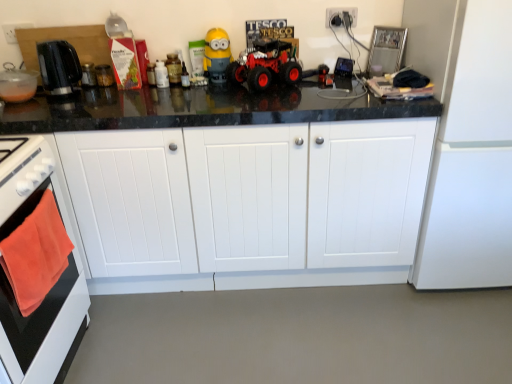
This screenshot has width=512, height=384. What do you see at coordinates (341, 14) in the screenshot? I see `white plastic electrical outlet at upper right` at bounding box center [341, 14].

Locate an element on the screen. white plastic electrical outlet at upper right is located at coordinates (341, 14).

The width and height of the screenshot is (512, 384). What do you see at coordinates (88, 75) in the screenshot? I see `metallic glass jar at upper left, arranged as the second appliance when viewed from the right` at bounding box center [88, 75].

I want to click on white matte refrigerator at right, so click(466, 141).

Describe the element at coordinates (250, 203) in the screenshot. I see `white wood cabinets at center` at that location.

Locate an element on the screen. matte black kettle at left, which appears as the third appliance when viewed from the right is located at coordinates (17, 84).

The image size is (512, 384). Identify the location of white plastic electrical outlet at upper right. (341, 14).

From the image's perspective, which one is positioned higher, transparent glass jar at center, which ranks as the 1th appliance in right-to-left order, or white matte refrigerator at right?

transparent glass jar at center, which ranks as the 1th appliance in right-to-left order, from the image's perspective.

Is transparent glass jar at center, acting as the third appliance starting from the left, in front of or behind white matte refrigerator at right in the image?

transparent glass jar at center, acting as the third appliance starting from the left, is positioned farther from the viewer than white matte refrigerator at right.

Which point is more distant from viewer, (109, 84) or (479, 238)?

The point (109, 84) is farther.

Is transparent glass jar at center, acting as the third appliance starting from the left, to the left or to the right of white matte refrigerator at right in the image?

In the image, transparent glass jar at center, acting as the third appliance starting from the left, appears on the left side of white matte refrigerator at right.

Which is more to the left, orange towel at left or black plastic kettle at left?

Positioned to the left is orange towel at left.

Looking at this image, how far apart are orange towel at left and black plastic kettle at left?

orange towel at left and black plastic kettle at left are 26.48 inches apart from each other.

Can you confirm if orange towel at left is smaller than black plastic kettle at left?

Incorrect, orange towel at left is not smaller in size than black plastic kettle at left.

Can black plastic kettle at left be found inside orange towel at left?

Actually, black plastic kettle at left is outside orange towel at left.

Is point (83, 67) less distant than point (65, 60)?

That is False.

From the image's perspective, is metallic glass jar at upper left, arranged as the second appliance when viewed from the right, on top of black plastic kettle at left?

Yes, from the image's perspective, metallic glass jar at upper left, arranged as the second appliance when viewed from the right, is on top of black plastic kettle at left.

Considering the sizes of metallic glass jar at upper left, positioned as the second appliance in left-to-right order, and black plastic kettle at left in the image, is metallic glass jar at upper left, positioned as the second appliance in left-to-right order, taller or shorter than black plastic kettle at left?

In the image, metallic glass jar at upper left, positioned as the second appliance in left-to-right order, appears to be shorter than black plastic kettle at left.

Is metallic glass jar at upper left, positioned as the second appliance in left-to-right order, located outside black plastic kettle at left?

Yes, metallic glass jar at upper left, positioned as the second appliance in left-to-right order, is located beyond the bounds of black plastic kettle at left.

Considering the positions of point (261, 74) and point (92, 67), is point (261, 74) closer or farther from the camera than point (92, 67)?

Point (261, 74) is positioned closer to the camera compared to point (92, 67).

From the image's perspective, relative to metallic glass jar at upper left, positioned as the second appliance in left-to-right order, is rubberized red toy car at center above or below?

From the image's perspective, rubberized red toy car at center appears above metallic glass jar at upper left, positioned as the second appliance in left-to-right order.

Who is smaller, rubberized red toy car at center or metallic glass jar at upper left, arranged as the second appliance when viewed from the right?

metallic glass jar at upper left, arranged as the second appliance when viewed from the right, is smaller.

From a real-world perspective, is rubberized red toy car at center physically located above or below metallic glass jar at upper left, arranged as the second appliance when viewed from the right?

From a real-world perspective, rubberized red toy car at center is physically above metallic glass jar at upper left, arranged as the second appliance when viewed from the right.

From the orange towel at left, count 2nd appliances backward and point to it. Please provide its 2D coordinates.

[(104, 75)]

Can you confirm if transparent glass jar at center, which ranks as the 1th appliance in right-to-left order, is smaller than orange towel at left?

Yes.

In terms of height, does transparent glass jar at center, acting as the third appliance starting from the left, look taller or shorter compared to orange towel at left?

In the image, transparent glass jar at center, acting as the third appliance starting from the left, appears to be shorter than orange towel at left.

Between point (110, 71) and point (30, 137), which one is positioned behind?

The point (110, 71) is more distant.

Does white plastic electrical outlet at upper right touch white matte refrigerator at right?

white plastic electrical outlet at upper right and white matte refrigerator at right are not in contact.

Does white plastic electrical outlet at upper right have a greater height compared to white matte refrigerator at right?

No, white plastic electrical outlet at upper right is not taller than white matte refrigerator at right.

In the scene shown: From a real-world perspective, which object stands above the other?

white plastic electrical outlet at upper right is physically above.

Can you confirm if white plastic electrical outlet at upper right is wider than white matte refrigerator at right?

No.

From a real-world perspective, is matte black kettle at left, the first appliance from the left, positioned above or below transparent glass jar at center, acting as the third appliance starting from the left?

In terms of real-world spatial position, matte black kettle at left, the first appliance from the left, is above transparent glass jar at center, acting as the third appliance starting from the left.

How different are the orientations of matte black kettle at left, the first appliance from the left, and transparent glass jar at center, acting as the third appliance starting from the left, in degrees?

0.00454 degrees separate the facing orientations of matte black kettle at left, the first appliance from the left, and transparent glass jar at center, acting as the third appliance starting from the left.

From their relative heights in the image, would you say matte black kettle at left, the first appliance from the left, is taller or shorter than transparent glass jar at center, which ranks as the 1th appliance in right-to-left order?

In the image, matte black kettle at left, the first appliance from the left, appears to be taller than transparent glass jar at center, which ranks as the 1th appliance in right-to-left order.

I want to click on refrigerator directly beneath the transparent glass jar at center, acting as the third appliance starting from the left (from a real-world perspective), so click(466, 141).

This screenshot has height=384, width=512. I want to click on kitchen appliance to the right of orange towel at left, so click(x=58, y=67).

Estimate the real-world distances between objects in this image. Which object is further from white wood cabinets at center, rubberized red toy car at center or white matte refrigerator at right?

rubberized red toy car at center is further to white wood cabinets at center.

From the image, which object appears to be farther from matte black kettle at left, which appears as the third appliance when viewed from the right, black plastic kettle at left or transparent glass jar at center, acting as the third appliance starting from the left?

transparent glass jar at center, acting as the third appliance starting from the left, is further to matte black kettle at left, which appears as the third appliance when viewed from the right.

Based on their spatial positions, is black plastic kettle at left or metallic glass jar at upper left, arranged as the second appliance when viewed from the right, closer to rubberized red toy car at center?

Based on the image, black plastic kettle at left appears to be nearer to rubberized red toy car at center.

Looking at the image, which one is located closer to white wood cabinets at center, transparent glass jar at center, which ranks as the 1th appliance in right-to-left order, or matte black kettle at left, which appears as the third appliance when viewed from the right?

transparent glass jar at center, which ranks as the 1th appliance in right-to-left order, is positioned closer to the anchor white wood cabinets at center.

Looking at the image, which one is located further to rubberized red toy car at center, black plastic kettle at left or orange towel at left?

orange towel at left.

Considering their positions, is metallic glass jar at upper left, positioned as the second appliance in left-to-right order, positioned closer to rubberized red toy car at center than white wood cabinets at center?

The object closer to rubberized red toy car at center is white wood cabinets at center.

Considering their positions, is white wood cabinets at center positioned further to white plastic electrical outlet at upper right than yellow matte minion at center?

The object further to white plastic electrical outlet at upper right is white wood cabinets at center.

Based on the photo, based on their spatial positions, is white matte refrigerator at right or matte black kettle at left, the first appliance from the left, further from rubberized red toy car at center?

matte black kettle at left, the first appliance from the left, is positioned further to the anchor rubberized red toy car at center.

Where is `kitchen appliance between yellow matte minion at center and orange towel at left in the up-down direction`? This screenshot has height=384, width=512. kitchen appliance between yellow matte minion at center and orange towel at left in the up-down direction is located at coordinates (58, 67).

Find the location of `cabinetry between black plastic kettle at left and white matte refrigerator at right`. cabinetry between black plastic kettle at left and white matte refrigerator at right is located at coordinates (250, 203).

Locate an element on the screen. Image resolution: width=512 pixels, height=384 pixels. toy car located between metallic glass jar at upper left, positioned as the second appliance in left-to-right order, and white plastic electrical outlet at upper right in the left-right direction is located at coordinates (265, 65).

In order to click on cabinetry between orange towel at left and white matte refrigerator at right in the horizontal direction in this screenshot , I will do `click(250, 203)`.